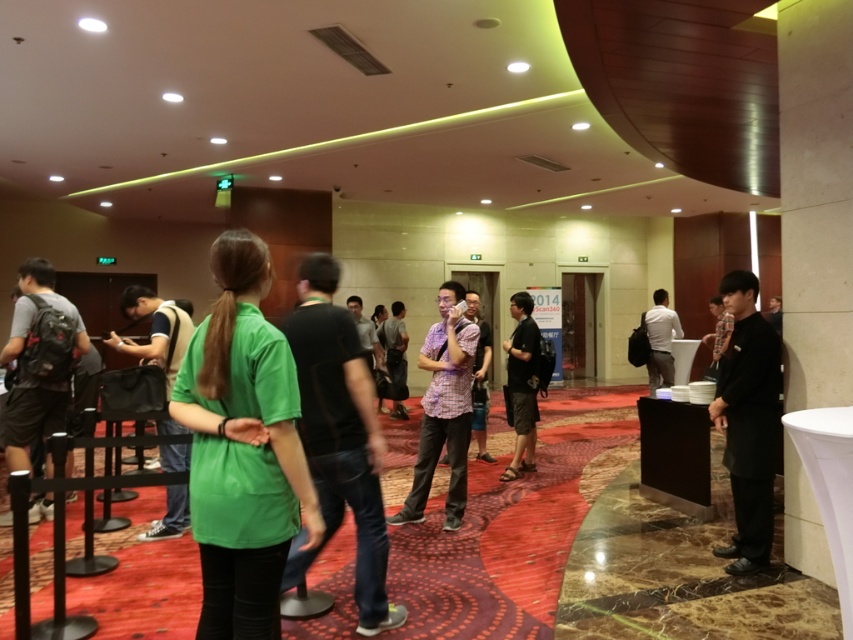
Question: Which point appears farthest from the camera in this image?

Choices:
 (A) (299, 314)
 (B) (762, 516)
 (C) (647, 328)

Answer: (C)

Question: Considering the real-world distances, which object is farthest from the black matte jacket at right?

Choices:
 (A) green matte shirt at center
 (B) matte black backpack at left

Answer: (B)

Question: Does dark green t-shirt at center have a smaller size compared to green fabric shirt at center?

Choices:
 (A) yes
 (B) no

Answer: (A)

Question: Does plaid fabric shirt at center appear on the left side of green fabric shirt at center?

Choices:
 (A) no
 (B) yes

Answer: (A)

Question: Is black matte jacket at right to the left of black matte shirt at center from the viewer's perspective?

Choices:
 (A) yes
 (B) no

Answer: (B)

Question: Which of the following is the closest to the observer?

Choices:
 (A) matte black backpack at left
 (B) plaid fabric shirt at center
 (C) dark green t-shirt at center
 (D) green matte shirt at center

Answer: (D)